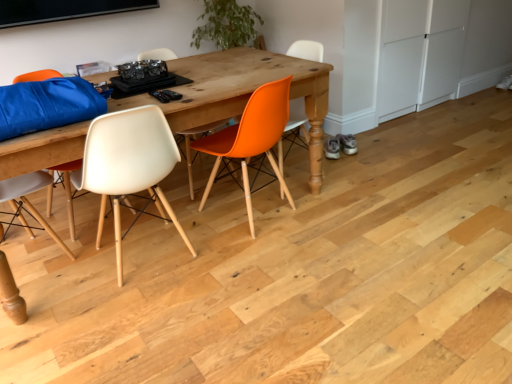
Question: From their relative heights in the image, would you say orange matte chair at center, which ranks as the first chair in right-to-left order, is taller or shorter than white matte cabinet at right?

Choices:
 (A) tall
 (B) short

Answer: (B)

Question: Is point (325, 100) positioned closer to the camera than point (392, 26)?

Choices:
 (A) farther
 (B) closer

Answer: (B)

Question: Which object is the closest to the white matte chair at center, which ranks as the 3th chair in right-to-left order?

Choices:
 (A) white matte cabinet at right
 (B) orange matte chair at center, arranged as the second chair when viewed from the right
 (C) wooden table at center
 (D) orange matte chair at center, positioned as the 3th chair in left-to-right order

Answer: (C)

Question: Which of these objects is positioned closest to the white matte chair at center, the 1th chair positioned from the left?

Choices:
 (A) orange matte chair at center, which is counted as the 2th chair, starting from the left
 (B) wooden table at center
 (C) orange matte chair at center, positioned as the 3th chair in left-to-right order
 (D) white matte cabinet at right

Answer: (B)